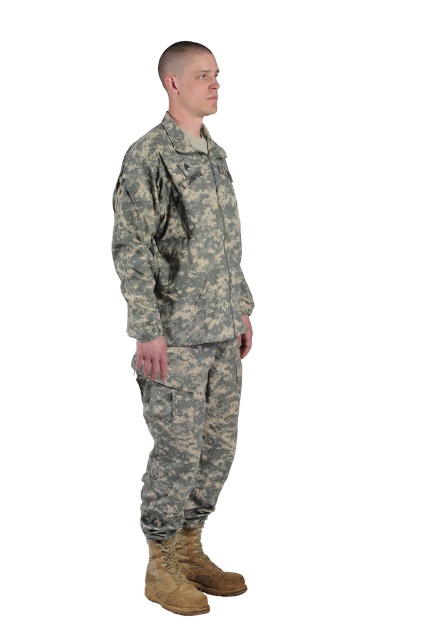
You are a photographer setting up a shoot with two boots, the tan suede boot at lower center and the brown leather boot at lower center. You want to place a small prop between them. Based on their positions, which boot should the prop be closer to?

The tan suede boot at lower center is positioned on the left side of brown leather boot at lower center, so the prop should be placed closer to the tan suede boot at lower center to maintain symmetry between both boots.

You are a photographer standing 10 feet away from the person in the image. You want to take a photo of the point at coordinates point (176, 566). Will you be able to capture that point in your photo if your camera has a minimum focus distance of 8 feet?

The distance of point (176, 566) from viewer is 8.42 feet, which is greater than the camera minimum focus distance of 8 feet. Therefore, you can capture that point in your photo.

You are a tailor trying to measure the distance between the camouflage fabric uniform at center and the brown leather boot at lower center for a custom fitting. If the vertical distance between them is 1 meter, and the uniform needs to be shortened by 15 cm to ensure the hem reaches the boot, what should the new length of the uniform be?

The camouflage fabric uniform at center is above the brown leather boot at lower center by 1 meter. To ensure the hem reaches the boot, the uniform should be shortened by 15 cm, resulting in a new length of 85 cm.